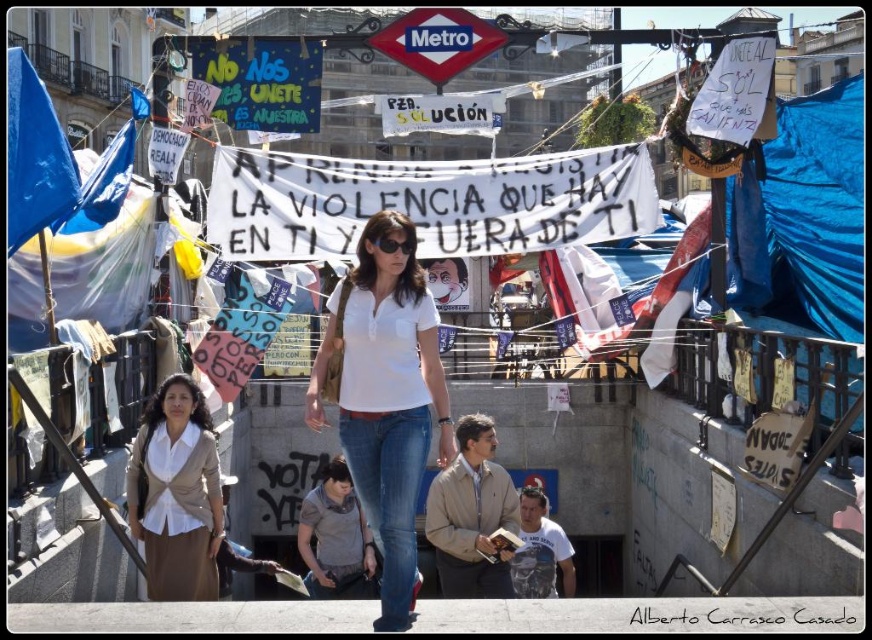
Question: Estimate the real-world distances between objects in this image. Which object is closer to the denim jeans at center?

Choices:
 (A) white matte shirt at center
 (B) beige fabric blouse at lower left

Answer: (A)

Question: Estimate the real-world distances between objects in this image. Which object is closer to the denim jeans at center?

Choices:
 (A) white matte shirt at center
 (B) beige fabric blouse at lower left

Answer: (A)

Question: Is beige fabric blouse at lower left thinner than denim jeans at center?

Choices:
 (A) no
 (B) yes

Answer: (A)

Question: Which object appears farthest from the camera in this image?

Choices:
 (A) beige fabric blouse at lower left
 (B) denim jeans at center

Answer: (A)

Question: Is white matte shirt at center thinner than denim jeans at center?

Choices:
 (A) no
 (B) yes

Answer: (A)

Question: Can you confirm if white matte shirt at center is thinner than denim jeans at center?

Choices:
 (A) yes
 (B) no

Answer: (B)